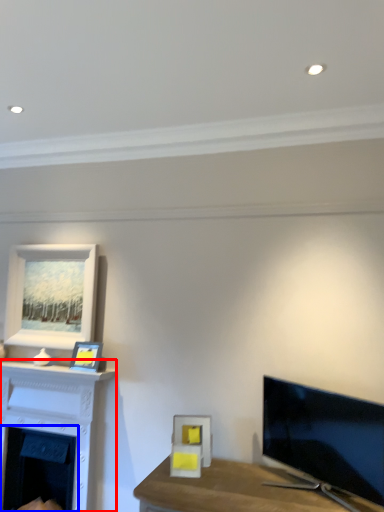
Question: Which point is further to the camera, fireplace (highlighted by a red box) or fireplace (highlighted by a blue box)?

Choices:
 (A) fireplace
 (B) fireplace

Answer: (B)